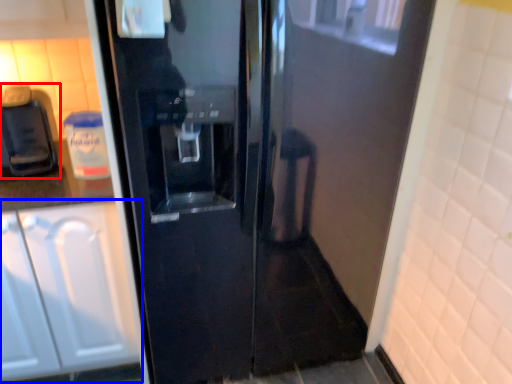
Question: Which point is further to the camera, coffee machine (highlighted by a red box) or cabinetry (highlighted by a blue box)?

Choices:
 (A) coffee machine
 (B) cabinetry

Answer: (A)